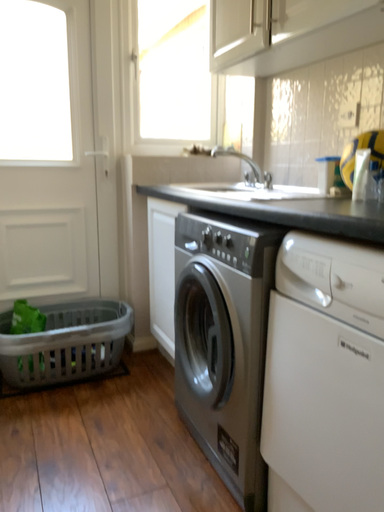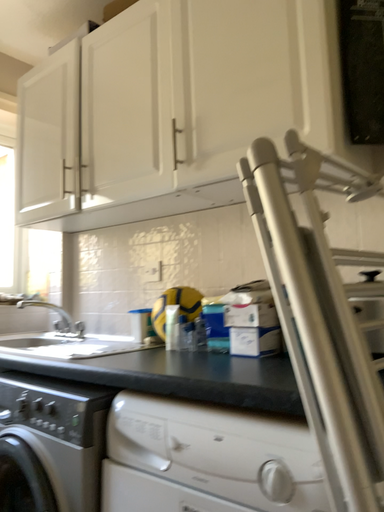
Question: How did the camera likely rotate when shooting the video?

Choices:
 (A) rotated downward
 (B) rotated upward

Answer: (B)